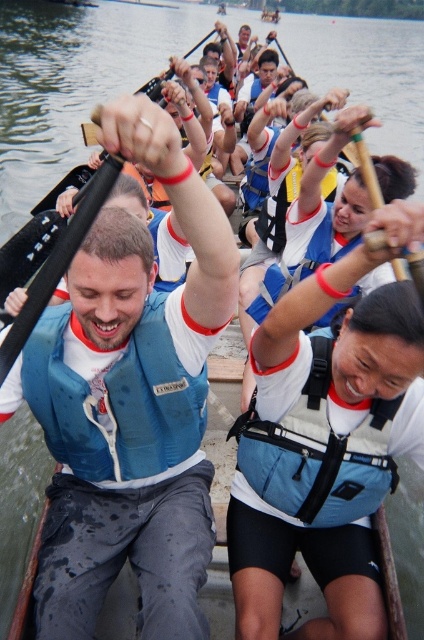
Is the position of blue fabric life jacket at center less distant than that of light blue fabric life jacket at center?

Yes, it is.

Which of these two, blue fabric life jacket at center or light blue fabric life jacket at center, stands taller?

With more height is light blue fabric life jacket at center.

Between point (94, 410) and point (276, 452), which one is positioned behind?

Positioned behind is point (276, 452).

Identify the location of blue fabric life jacket at center. (116, 401).

Is point (41, 605) less distant than point (367, 456)?

Yes, it is in front of point (367, 456).

Identify the location of blue life vest at center. This screenshot has width=424, height=640. (127, 548).

Can you confirm if blue life vest at center is smaller than blue fabric life jacket at center?

Actually, blue life vest at center might be larger than blue fabric life jacket at center.

Is point (109, 369) closer to viewer compared to point (175, 448)?

Yes, point (109, 369) is in front of point (175, 448).

Locate an element on the screen. blue life vest at center is located at coordinates (127, 548).